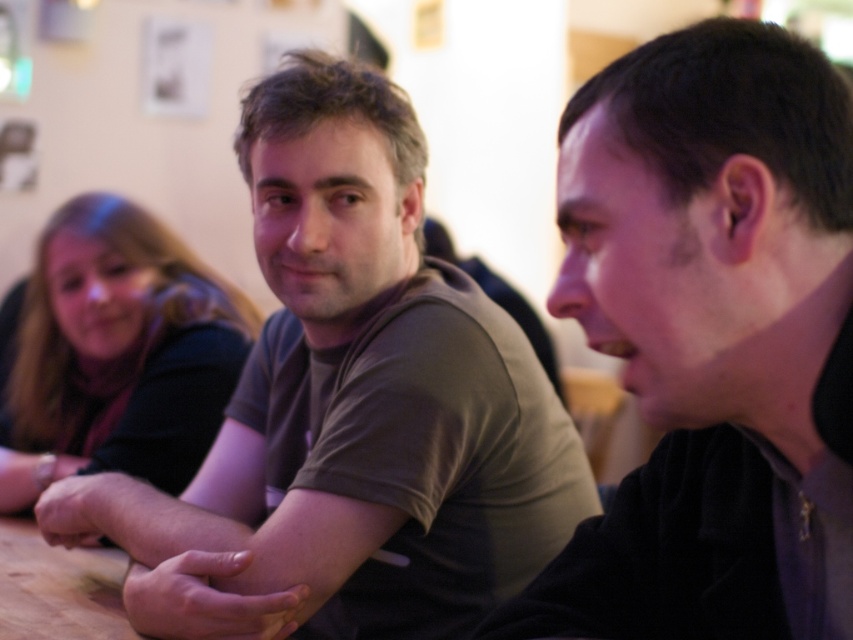
You are a fashion designer observing this scene. You need to design a new line of shirts that will fit both the brown matte shirt at center and the matte black shirt at upper left. Given their size difference, what adjustment should you make to the design?

The brown matte shirt at center has a larger size compared to the matte black shirt at upper left. To accommodate both sizes, the new shirt design should include adjustable elements like elastic cuffs or extendable back panels to allow for varying sizes.

You are a photographer adjusting your camera to focus on the black matte shirt at center. Since you can only focus on one subject at a time, will you need to adjust the focus to capture the brown matte shirt at center clearly?

The black matte shirt at center is behind the brown matte shirt at center, so to focus on the black matte shirt at center, you would need to adjust the focus away from the brown matte shirt at center.

You are a photographer trying to capture a group photo of the two men at the table. The brown matte shirt at center and the black matte shirt at center are the subjects. To ensure both are centered in the frame, should you move the camera to the left or right of the current position?

The brown matte shirt at center is positioned on the left side of black matte shirt at center. To center both in the frame, move the camera slightly to the right so that the black matte shirt at center is more towards the center, pulling the brown matte shirt at center into alignment as well.